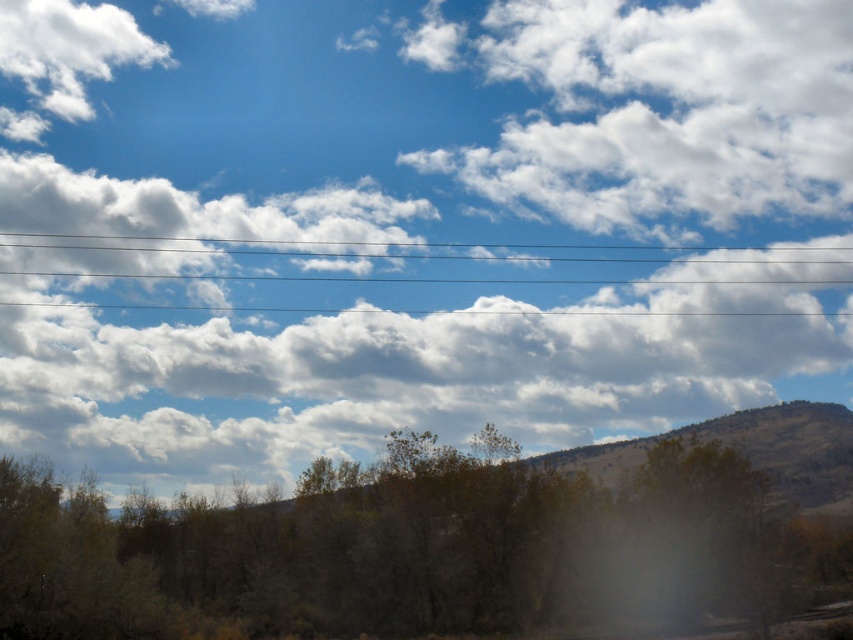
You are standing at the origin point of the coordinate system in the image. You want to walk towards the brown matte tree at center. What direction should you head in?

The brown matte tree at center is located at coordinate point 0.866 on the x axis and 0.488 on the y axis. Since you are at the origin, you should move in the positive x and positive y direction to reach it.

You are standing in the landscape scene and want to find the brown matte tree at center. According to the coordinates provided, where should you look to locate it?

The brown matte tree at center is located at coordinates point (415, 554).

You are an artist trying to paint the scene. You want to ensure the brown matte tree at center and the clear plastic power lines at upper center are proportionally accurate. Which object should you draw with a narrower width?

The brown matte tree at center should be drawn with a narrower width since it is thinner than the clear plastic power lines at upper center according to the description.